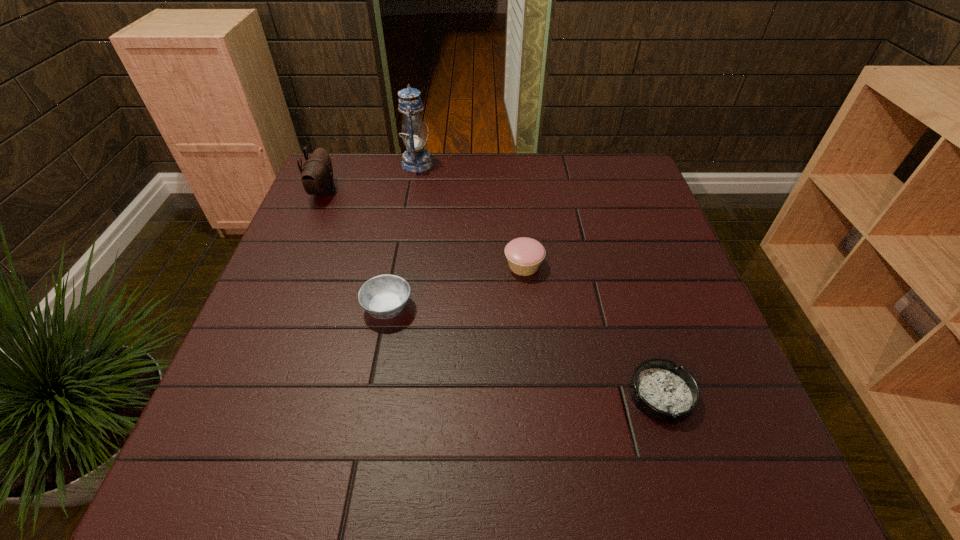
Identify the location of vacant space located 0.350m on the front-facing side of the tallest object. (545, 164).

Where is `free space located with the flap open on the second tallest object`? free space located with the flap open on the second tallest object is located at coordinates (440, 192).

You are a GUI agent. You are given a task and a screenshot of the screen. Output one action in this format:
    pyautogui.click(x=<x>, y=<y>)
    Task: Click on the free spot located on the front of the cupcake
    
    Given the screenshot: What is the action you would take?
    pyautogui.click(x=541, y=444)

At what (x,y) coordinates should I click in order to perform the action: click on free space located 0.230m on the back of the fourth farthest object. Please return your answer as a coordinate pair (x, y). This screenshot has width=960, height=540. Looking at the image, I should click on (403, 225).

Identify the location of vacant point located 0.080m on the right of the nearest object. (735, 395).

At what (x,y) coordinates should I click in order to perform the action: click on lantern that is positioned at the far edge. Please return your answer as a coordinate pair (x, y). Looking at the image, I should click on (416, 159).

The width and height of the screenshot is (960, 540). Identify the location of pouch present at the far edge. (317, 174).

The image size is (960, 540). Find the location of `object located in the left edge section of the desktop`. object located in the left edge section of the desktop is located at coordinates (317, 174).

The width and height of the screenshot is (960, 540). What are the coordinates of `object that is positioned at the right edge` in the screenshot? It's located at (663, 391).

You are a GUI agent. You are given a task and a screenshot of the screen. Output one action in this format:
    pyautogui.click(x=<x>, y=<y>)
    Task: Click on the object at the far left corner
    The image size is (960, 540).
    Given the screenshot: What is the action you would take?
    coord(317,174)